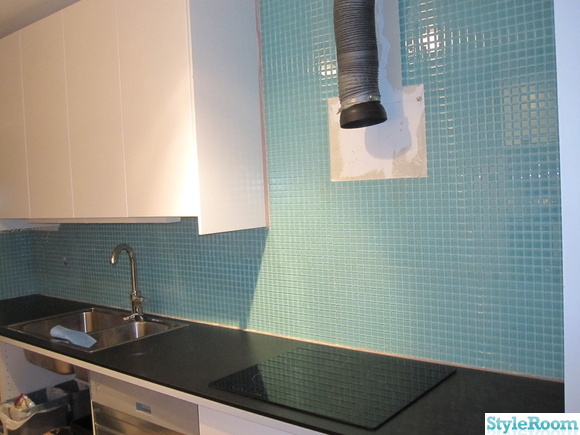
Identify the location of leftmost cabinet. The width and height of the screenshot is (580, 435). (14, 50).